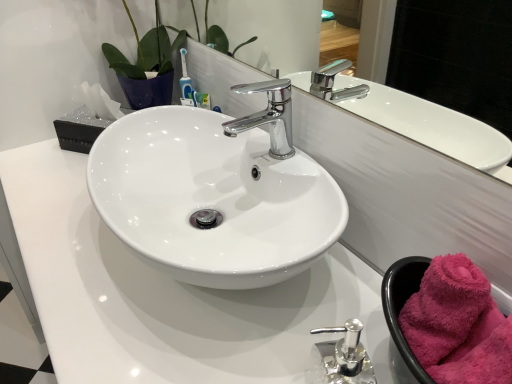
Question: Is white glossy counter top at center in front of chrome/metallic faucet at center?

Choices:
 (A) yes
 (B) no

Answer: (A)

Question: Is white glossy counter top at center next to chrome/metallic faucet at center and touching it?

Choices:
 (A) yes
 (B) no

Answer: (B)

Question: From the image's perspective, is white glossy counter top at center under chrome/metallic faucet at center?

Choices:
 (A) no
 (B) yes

Answer: (B)

Question: Does white glossy counter top at center have a larger size compared to chrome/metallic faucet at center?

Choices:
 (A) yes
 (B) no

Answer: (A)

Question: From a real-world perspective, is white glossy counter top at center physically above chrome/metallic faucet at center?

Choices:
 (A) no
 (B) yes

Answer: (A)

Question: Relative to chrome/metallic faucet at center, is pink fluffy bath towel at lower right in front or behind?

Choices:
 (A) front
 (B) behind

Answer: (A)

Question: Considering the positions of point (446, 276) and point (283, 158), is point (446, 276) closer or farther from the camera than point (283, 158)?

Choices:
 (A) farther
 (B) closer

Answer: (B)

Question: From the image's perspective, is pink fluffy bath towel at lower right located above or below chrome/metallic faucet at center?

Choices:
 (A) above
 (B) below

Answer: (B)

Question: Looking at the image, does pink fluffy bath towel at lower right seem bigger or smaller compared to chrome/metallic faucet at center?

Choices:
 (A) big
 (B) small

Answer: (B)

Question: From the image's perspective, is chrome/metallic faucet at center positioned above or below pink fluffy bath towel at lower right?

Choices:
 (A) above
 (B) below

Answer: (A)

Question: Do you think chrome/metallic faucet at center is within pink fluffy bath towel at lower right, or outside of it?

Choices:
 (A) outside
 (B) inside

Answer: (A)

Question: In terms of size, does chrome/metallic faucet at center appear bigger or smaller than pink fluffy bath towel at lower right?

Choices:
 (A) big
 (B) small

Answer: (A)

Question: Relative to pink fluffy bath towel at lower right, is chrome/metallic faucet at center in front or behind?

Choices:
 (A) behind
 (B) front

Answer: (A)

Question: Considering the positions of white glossy counter top at center and glossy ceramic mirror at upper center in the image, is white glossy counter top at center taller or shorter than glossy ceramic mirror at upper center?

Choices:
 (A) short
 (B) tall

Answer: (B)

Question: Considering the positions of point (337, 279) and point (268, 36), is point (337, 279) closer or farther from the camera than point (268, 36)?

Choices:
 (A) closer
 (B) farther

Answer: (A)